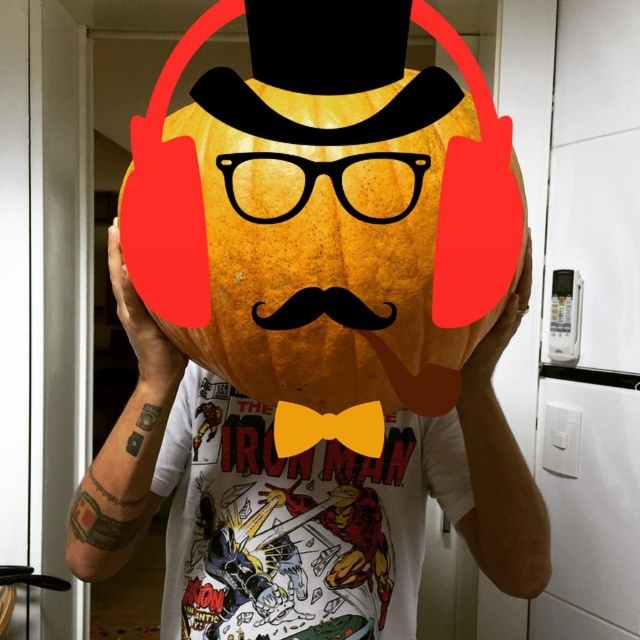
Based on the photo, is orange matte pumpkin at center thinner than yellow fabric bow tie at center?

In fact, orange matte pumpkin at center might be wider than yellow fabric bow tie at center.

Is point (356, 106) farther from viewer compared to point (374, 404)?

No, it is in front of (374, 404).

Locate an element on the screen. The image size is (640, 640). orange matte pumpkin at center is located at coordinates (324, 228).